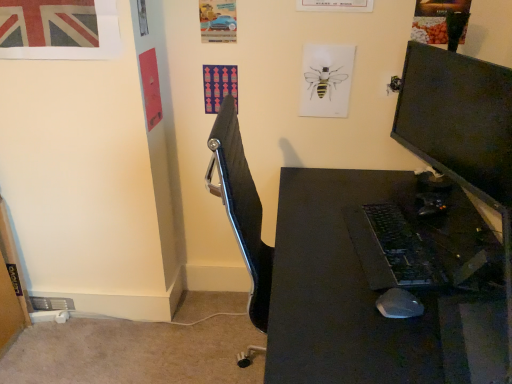
Image resolution: width=512 pixels, height=384 pixels. I want to click on vacant area that lies to the right of black plastic mouse at lower right, so click(x=436, y=299).